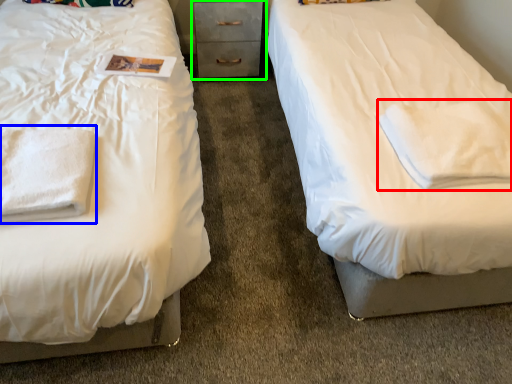
Question: Which object is the closest to the cloth (highlighted by a red box)? Choose among these: cloth (highlighted by a blue box) or chest of drawers (highlighted by a green box).

Choices:
 (A) cloth
 (B) chest of drawers

Answer: (A)